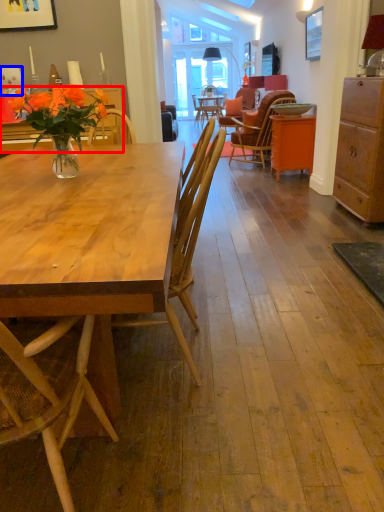
Question: Which of the following is the closest to the observer, desk (highlighted by a red box) or coffee cup (highlighted by a blue box)?

Choices:
 (A) desk
 (B) coffee cup

Answer: (A)